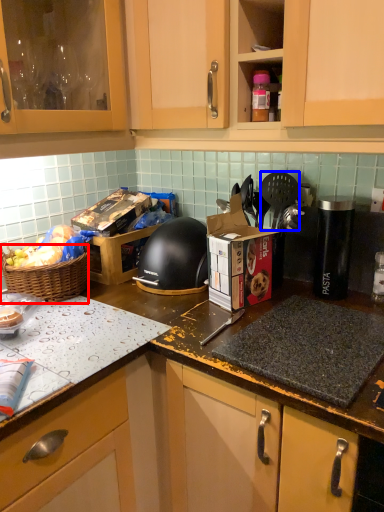
Question: Among these objects, which one is nearest to the camera, picnic basket (highlighted by a red box) or spatula (highlighted by a blue box)?

Choices:
 (A) picnic basket
 (B) spatula

Answer: (A)